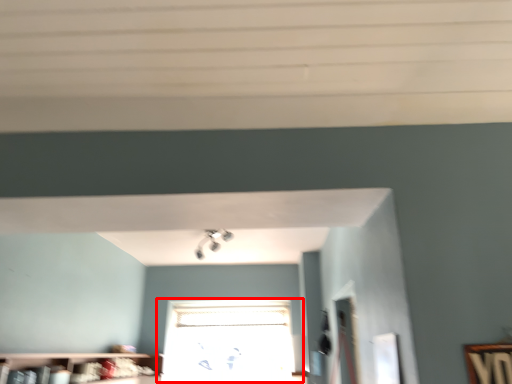
Question: In this image, where is window (annotated by the red box) located relative to shelf?

Choices:
 (A) right
 (B) left

Answer: (A)